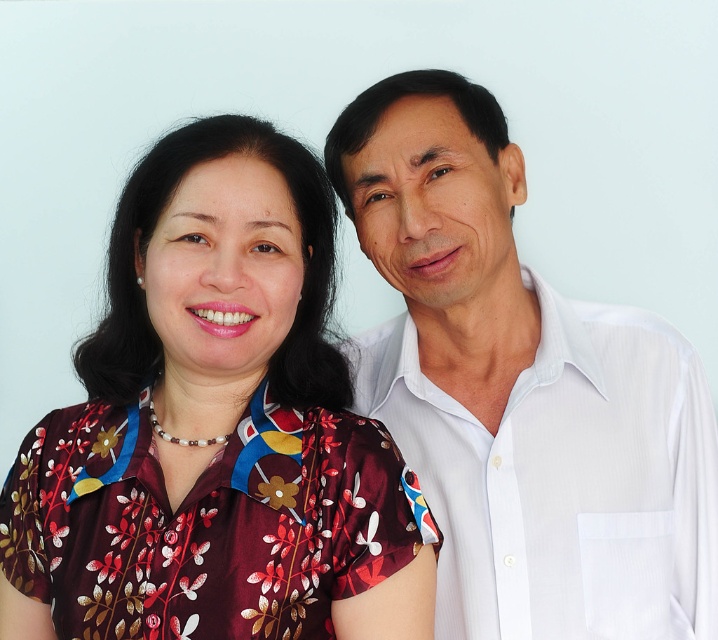
This screenshot has width=718, height=640. Identify the location of floral silk blouse at center. (215, 428).